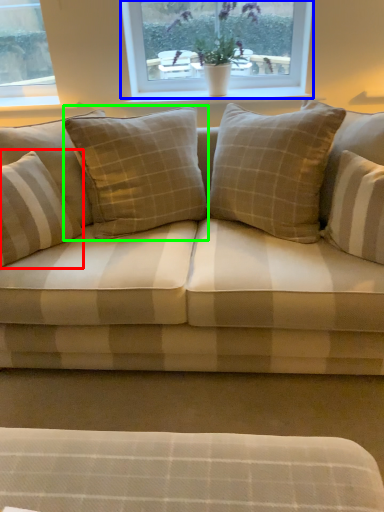
Question: Considering the real-world distances, which object is closest to pillow (highlighted by a red box)? window (highlighted by a blue box) or pillow (highlighted by a green box).

Choices:
 (A) window
 (B) pillow

Answer: (B)